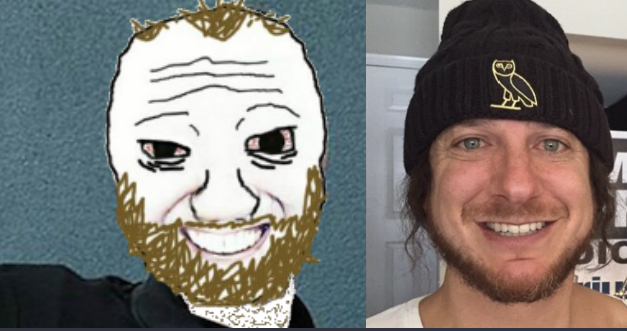
The width and height of the screenshot is (627, 331). I want to click on area above door, so pos(394,28).